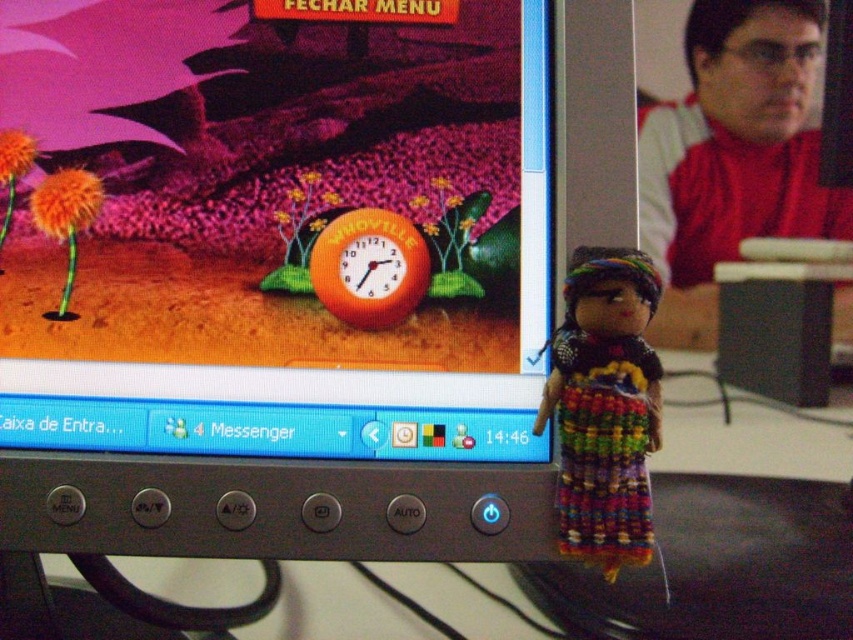
You are a game developer working on a new puzzle game. You need to place a new object at coordinates that are exactly 0.1 units to the right of the matte plastic monitor at center. What are the coordinates where you should place the new object?

The coordinates to place the new object would be 0.355 plus 0.1 in the x direction, so the new coordinates are (279, 291).

You are a person with a height of 5 feet 6 inches. You are standing in front of the matte plastic monitor at center. Can you comfortably view the monitor without needing to tilt your head up or down?

The matte plastic monitor at center is 29.08 inches away from viewer, so yes, you can comfortably view the monitor without needing to tilt your head up or down since the distance is appropriate for average viewing.

You are a drone operator controlling a drone that needs to hover exactly at point (762, 12). The drone has a maximum flight range of 35 inches. Can the drone reach the point from your current position?

The distance between point (762, 12) and the camera is 34.72 inches, which is within the drone operator drone maximum flight range of 35 inches. Therefore, the drone can reach the point.